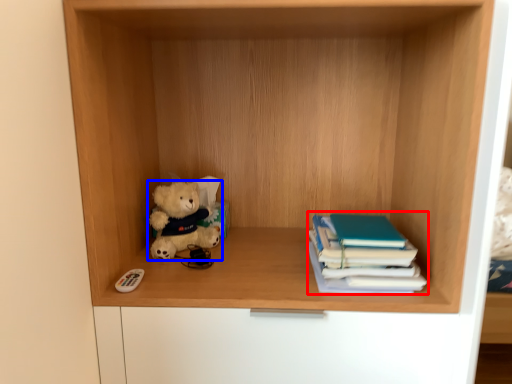
Question: Which point is closer to the camera, book (highlighted by a red box) or teddy bear (highlighted by a blue box)?

Choices:
 (A) book
 (B) teddy bear

Answer: (A)